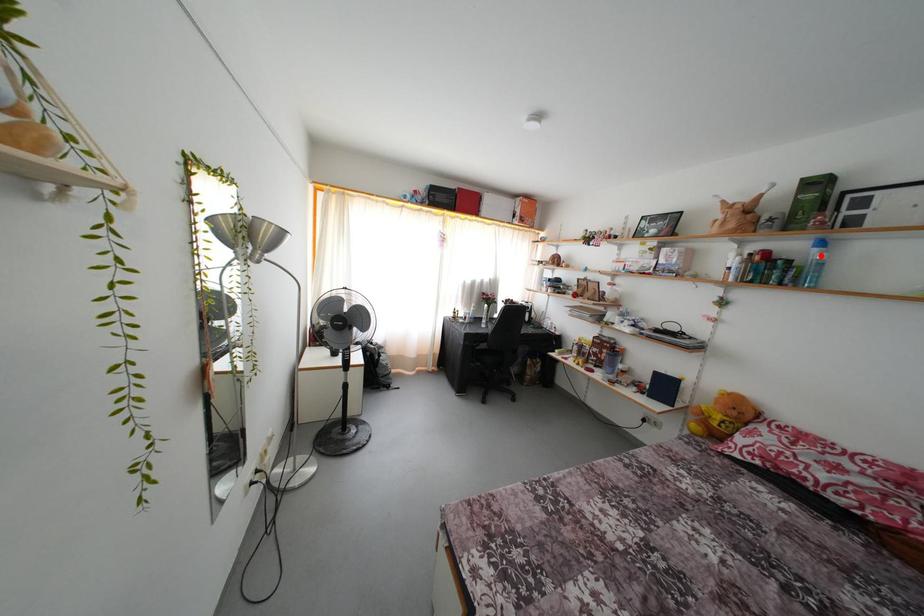
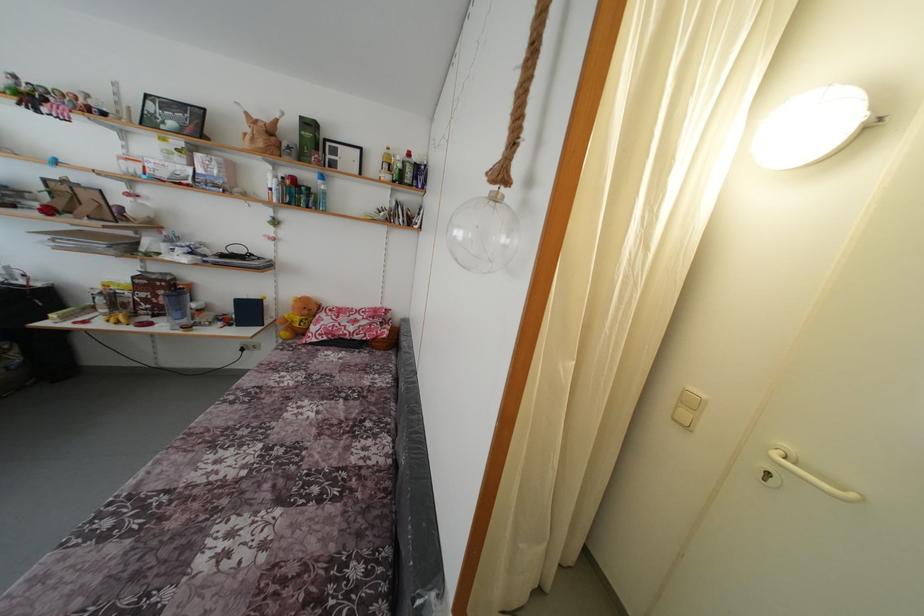
Question: I am providing you with two images of the same scene from different viewpoints. Given a red point in image1, look at the same physical point in image2. Is it:

Choices:
 (A) Closer to the viewpoint
 (B) Farther from the viewpoint

Answer: (A)